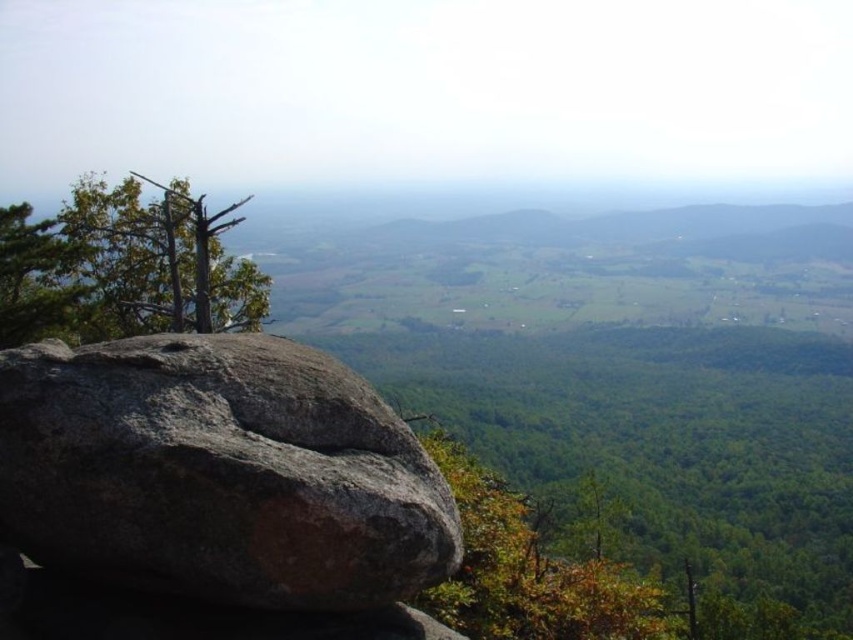
Is the position of gray rough rock at center less distant than that of green leafy tree at upper left?

Yes, gray rough rock at center is closer to the viewer.

The image size is (853, 640). Describe the element at coordinates (218, 472) in the screenshot. I see `gray rough rock at center` at that location.

Is point (85, 406) more distant than point (21, 246)?

No.

Where is `gray rough rock at center`? The image size is (853, 640). gray rough rock at center is located at coordinates (218, 472).